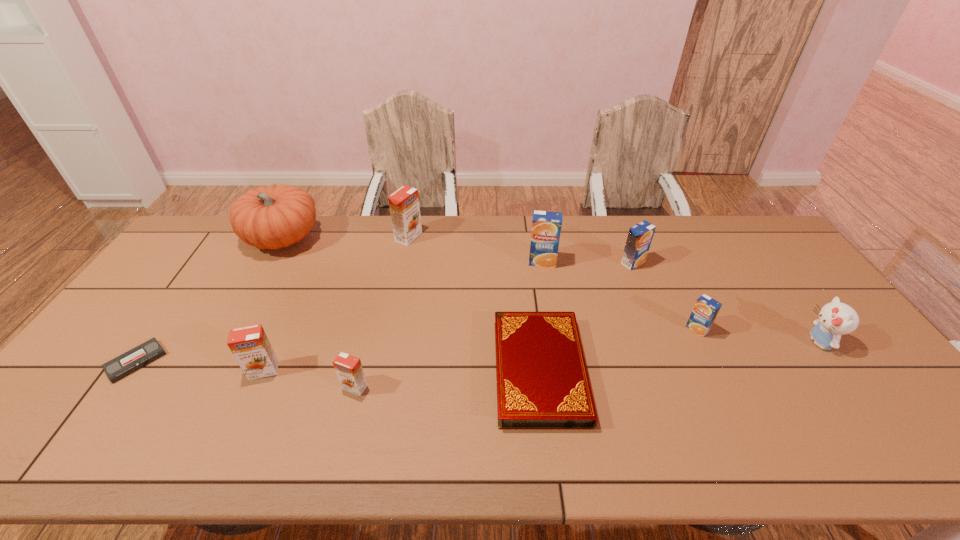
Identify the location of vacant space located on the back of the leftmost orange juice. This screenshot has height=540, width=960. (295, 300).

Where is `vacant space located 0.200m on the front-facing side of the rightmost object`? The width and height of the screenshot is (960, 540). vacant space located 0.200m on the front-facing side of the rightmost object is located at coordinates (732, 342).

Where is `vacant region located on the front-facing side of the rightmost object`? vacant region located on the front-facing side of the rightmost object is located at coordinates (695, 342).

Where is `free space located on the front-facing side of the rightmost object`? free space located on the front-facing side of the rightmost object is located at coordinates (677, 342).

You are a GUI agent. You are given a task and a screenshot of the screen. Output one action in this format:
    pyautogui.click(x=<x>, y=<y>)
    Task: Click on the vacant space located 0.320m on the front of the fourth farthest orange juice
    The image size is (960, 540).
    Given the screenshot: What is the action you would take?
    pyautogui.click(x=755, y=447)

You are a GUI agent. You are given a task and a screenshot of the screen. Output one action in this format:
    pyautogui.click(x=<x>, y=<y>)
    Task: Click on the free space located 0.110m on the left of the smallest orange orange juice
    This screenshot has height=540, width=960.
    Given the screenshot: What is the action you would take?
    pyautogui.click(x=299, y=387)

Identify the location of vacant space located 0.060m on the cover of the ninth tallest object. This screenshot has width=960, height=540. (550, 455).

Locate an element on the screen. The width and height of the screenshot is (960, 540). vacant space located 0.190m on the front of the shortest object is located at coordinates (68, 457).

The width and height of the screenshot is (960, 540). Identify the location of pumpkin that is at the far edge. (273, 217).

This screenshot has width=960, height=540. I want to click on object located in the near edge section of the desktop, so click(542, 379).